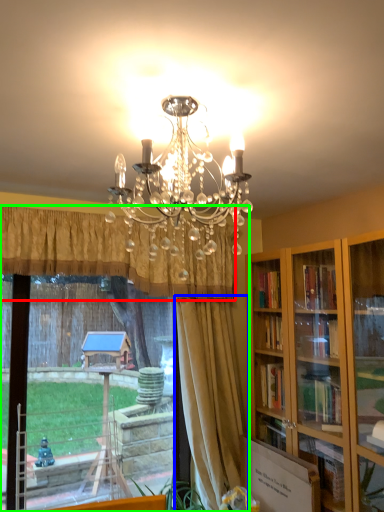
Question: Based on their relative distances, which object is nearer to curtain (highlighted by a red box)? Choose from curtain (highlighted by a blue box) and window (highlighted by a green box).

Choices:
 (A) curtain
 (B) window

Answer: (B)